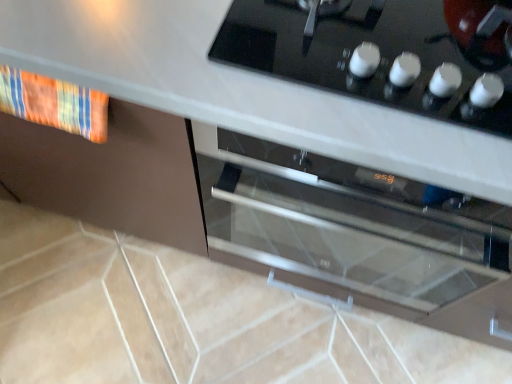
Question: Is satin silver oven at center positioned before textured fabric towel at left?

Choices:
 (A) no
 (B) yes

Answer: (B)

Question: Can you confirm if satin silver oven at center is positioned to the left of textured fabric towel at left?

Choices:
 (A) yes
 (B) no

Answer: (B)

Question: Is satin silver oven at center touching textured fabric towel at left?

Choices:
 (A) no
 (B) yes

Answer: (A)

Question: Can you confirm if satin silver oven at center is bigger than textured fabric towel at left?

Choices:
 (A) yes
 (B) no

Answer: (A)

Question: Is satin silver oven at center looking in the opposite direction of textured fabric towel at left?

Choices:
 (A) yes
 (B) no

Answer: (B)

Question: From the image's perspective, is black glass cooktop at upper center positioned above or below satin silver oven at center?

Choices:
 (A) above
 (B) below

Answer: (A)

Question: From a real-world perspective, relative to satin silver oven at center, is black glass cooktop at upper center vertically above or below?

Choices:
 (A) above
 (B) below

Answer: (A)

Question: Considering their positions, is black glass cooktop at upper center located in front of or behind satin silver oven at center?

Choices:
 (A) front
 (B) behind

Answer: (A)

Question: In terms of height, does black glass cooktop at upper center look taller or shorter compared to satin silver oven at center?

Choices:
 (A) tall
 (B) short

Answer: (B)

Question: In terms of height, does textured fabric towel at left look taller or shorter compared to black glass cooktop at upper center?

Choices:
 (A) short
 (B) tall

Answer: (B)

Question: Which is correct: textured fabric towel at left is inside black glass cooktop at upper center, or outside of it?

Choices:
 (A) outside
 (B) inside

Answer: (A)

Question: Is textured fabric towel at left in front of or behind black glass cooktop at upper center in the image?

Choices:
 (A) behind
 (B) front

Answer: (A)

Question: Based on their sizes in the image, would you say textured fabric towel at left is bigger or smaller than black glass cooktop at upper center?

Choices:
 (A) small
 (B) big

Answer: (A)

Question: In terms of width, does satin silver oven at center look wider or thinner when compared to textured fabric towel at left?

Choices:
 (A) wide
 (B) thin

Answer: (A)

Question: From their relative heights in the image, would you say satin silver oven at center is taller or shorter than textured fabric towel at left?

Choices:
 (A) short
 (B) tall

Answer: (B)